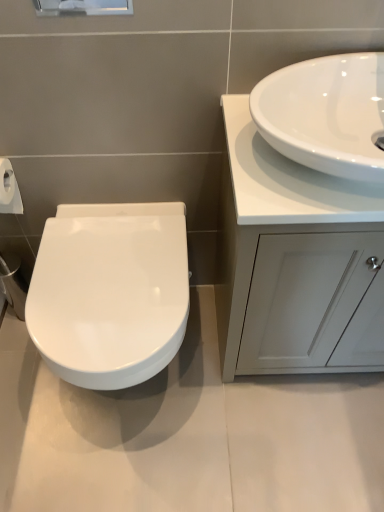
The image size is (384, 512). In order to click on free space in front of white glossy cabinet at right in this screenshot , I will do `click(297, 438)`.